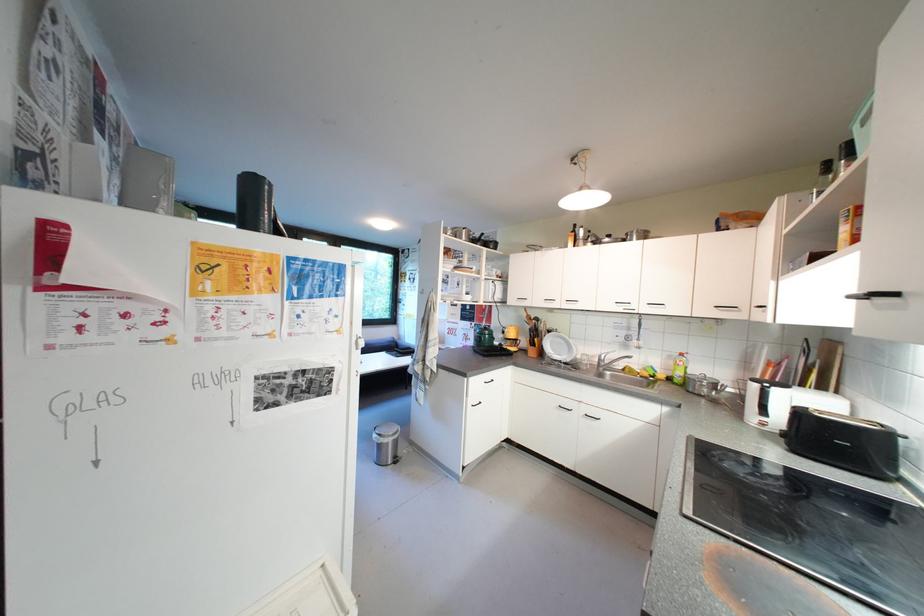
This screenshot has width=924, height=616. Find the location of `black drawer handle`. black drawer handle is located at coordinates (489, 378).